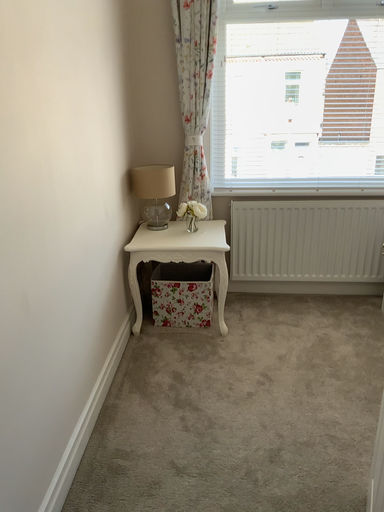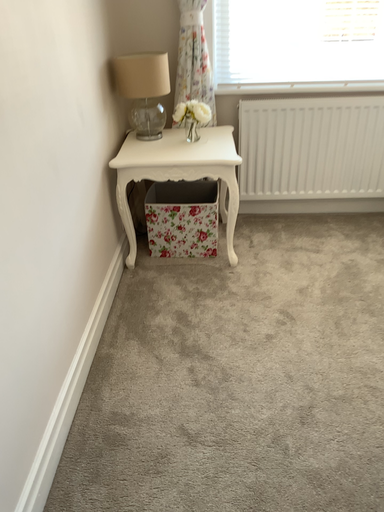
Question: Which way did the camera rotate in the video?

Choices:
 (A) rotated upward
 (B) rotated downward

Answer: (B)